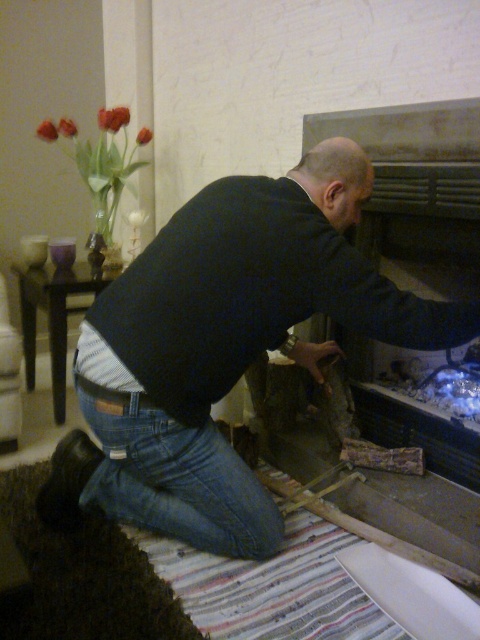
Is dark blue sweater at center wider than denim at lower left?

Yes.

Does dark blue sweater at center have a smaller size compared to denim at lower left?

No.

The image size is (480, 640). What are the coordinates of `dark blue sweater at center` in the screenshot? It's located at (223, 348).